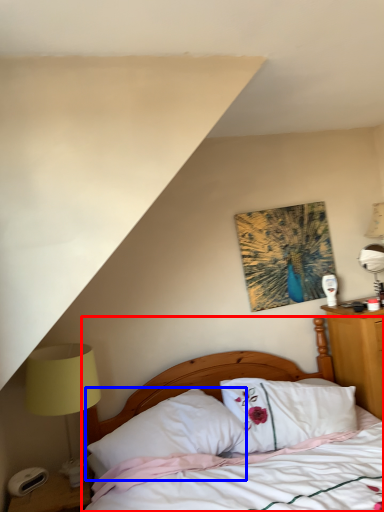
Question: Which point is closer to the camera, bed (highlighted by a red box) or pillow (highlighted by a blue box)?

Choices:
 (A) bed
 (B) pillow

Answer: (A)